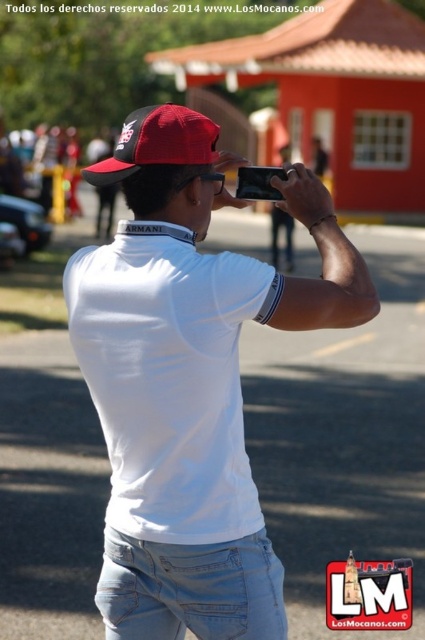
Question: Is light blue denim jeans at center smaller than red matte cap at center?

Choices:
 (A) no
 (B) yes

Answer: (B)

Question: Which point is closer to the camera taking this photo?

Choices:
 (A) [178, 444]
 (B) [104, 560]

Answer: (A)

Question: Which object appears farthest from the camera in this image?

Choices:
 (A) white matte shirt at center
 (B) light blue denim jeans at center
 (C) red matte cap at center

Answer: (C)

Question: Does light blue denim jeans at center appear on the right side of red matte cap at center?

Choices:
 (A) no
 (B) yes

Answer: (B)

Question: Considering the relative positions of white matte shirt at center and white cotton t-shirt at center in the image provided, where is white matte shirt at center located with respect to white cotton t-shirt at center?

Choices:
 (A) above
 (B) below

Answer: (B)

Question: Which of the following is the closest to the observer?

Choices:
 (A) white matte shirt at center
 (B) light blue denim jeans at center

Answer: (A)